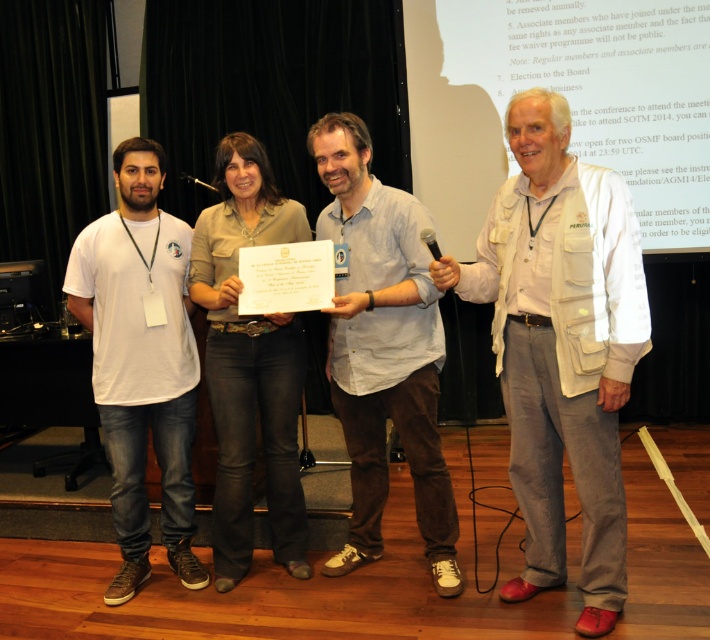
Can you confirm if white cotton t-shirt at left is thinner than metallic at left?

Incorrect, white cotton t-shirt at left's width is not less than metallic at left's.

Is point (146, 200) less distant than point (180, 173)?

Yes, it is.

Does point (138, 531) come behind point (192, 179)?

That is False.

This screenshot has width=710, height=640. I want to click on white cotton t-shirt at left, so tap(142, 362).

Who is positioned more to the right, white textured vest at center or black plastic microphone at upper center?

white textured vest at center is more to the right.

From the picture: Is white textured vest at center to the left of black plastic microphone at upper center from the viewer's perspective?

Incorrect, white textured vest at center is not on the left side of black plastic microphone at upper center.

The width and height of the screenshot is (710, 640). I want to click on white textured vest at center, so click(x=562, y=346).

Consider the image. Who is more distant from viewer, (376, 221) or (160, 376)?

The point (160, 376) is behind.

Is point (452, 579) closer to viewer compared to point (136, 138)?

Yes, it is in front of point (136, 138).

Locate an element on the screen. This screenshot has height=640, width=710. white cotton shirt at center is located at coordinates (382, 349).